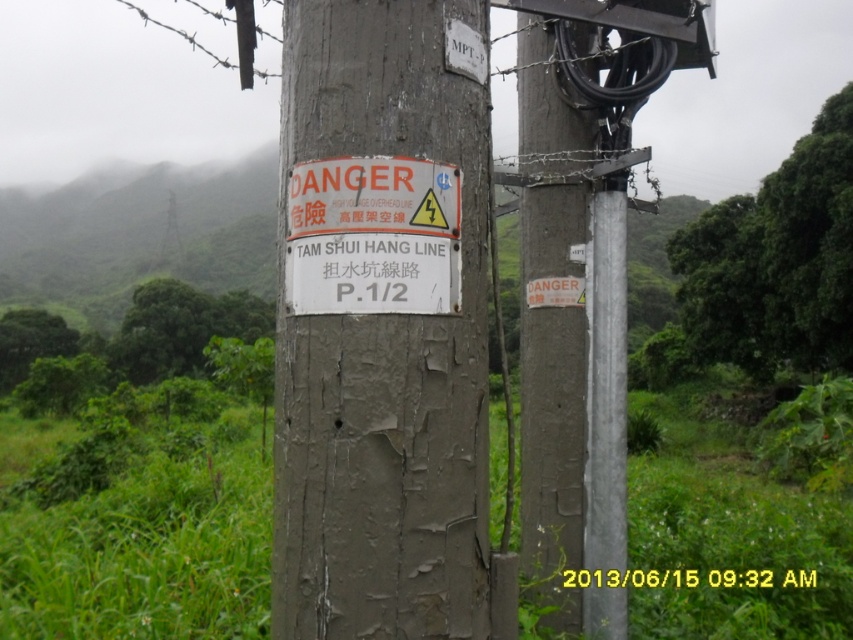
Question: Is weathered wood post at right in front of white paper sign at center?

Choices:
 (A) yes
 (B) no

Answer: (B)

Question: Is weathered wood post at right thinner than white paper sign at center?

Choices:
 (A) yes
 (B) no

Answer: (A)

Question: Considering the real-world distances, which object is farthest from the weathered wood post at right?

Choices:
 (A) white paper sign at center
 (B) gray weathered wood post at center

Answer: (A)

Question: Estimate the real-world distances between objects in this image. Which object is farther from the weathered wood post at right?

Choices:
 (A) white paper sign at center
 (B) gray weathered wood post at center

Answer: (A)

Question: Which of the following is the closest to the observer?

Choices:
 (A) white paper sign at center
 (B) gray weathered wood post at center

Answer: (B)

Question: Is weathered wood post at right positioned before white paper sign at center?

Choices:
 (A) no
 (B) yes

Answer: (A)